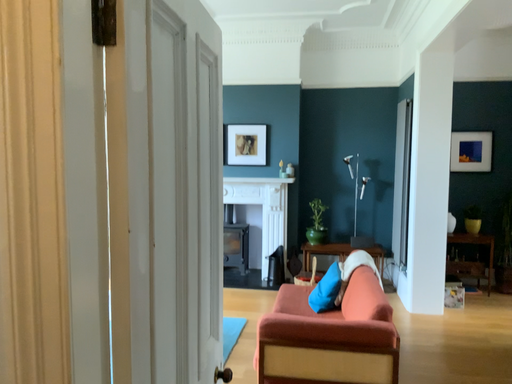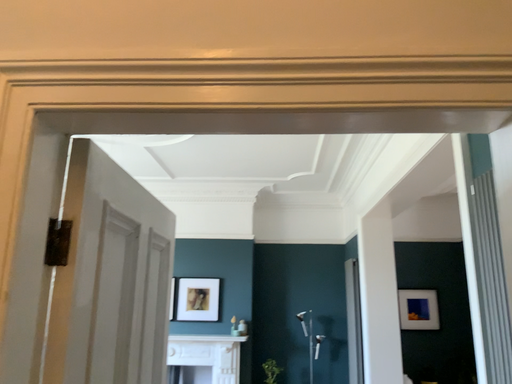
Question: Which way did the camera rotate in the video?

Choices:
 (A) rotated downward
 (B) rotated upward

Answer: (B)